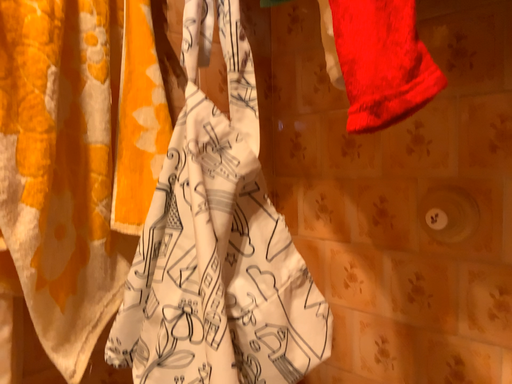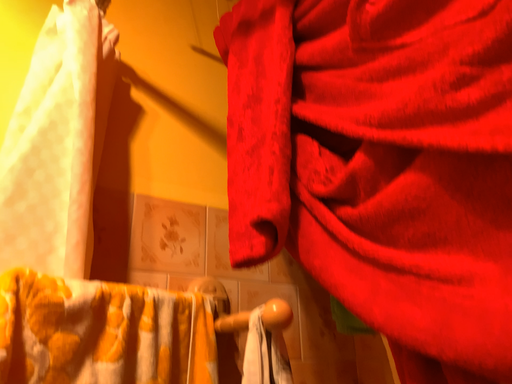
Question: Which way did the camera rotate in the video?

Choices:
 (A) rotated downward
 (B) rotated upward

Answer: (B)